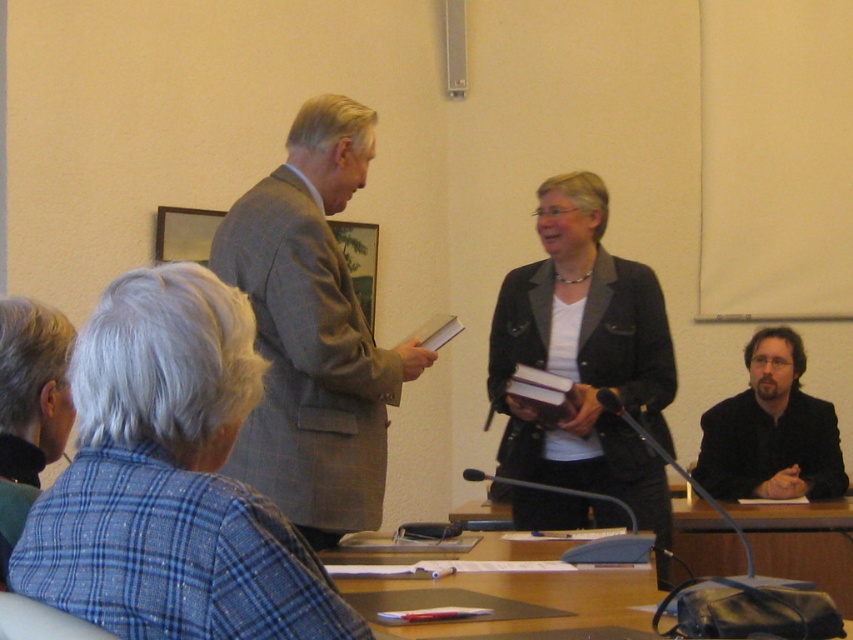
Question: Based on their relative distances, which object is nearer to the gray woolen jacket at lower left?

Choices:
 (A) dark gray blazer at center
 (B) dark brown suit at lower right
 (C) gray textured suit at center
 (D) wooden table at lower center

Answer: (C)

Question: Which object is farther from the camera taking this photo?

Choices:
 (A) gray wool suit at upper center
 (B) gray woolen jacket at lower left
 (C) wooden table at lower center

Answer: (C)

Question: Does gray textured suit at center have a smaller size compared to wooden table at lower center?

Choices:
 (A) yes
 (B) no

Answer: (B)

Question: Can you confirm if dark gray blazer at center is bigger than dark brown suit at lower right?

Choices:
 (A) no
 (B) yes

Answer: (B)

Question: Is gray wool suit at upper center bigger than gray textured suit at center?

Choices:
 (A) yes
 (B) no

Answer: (B)

Question: Which point is farther to the camera?

Choices:
 (A) (756, 538)
 (B) (305, 209)
 (C) (235, 588)
 (D) (643, 337)

Answer: (A)